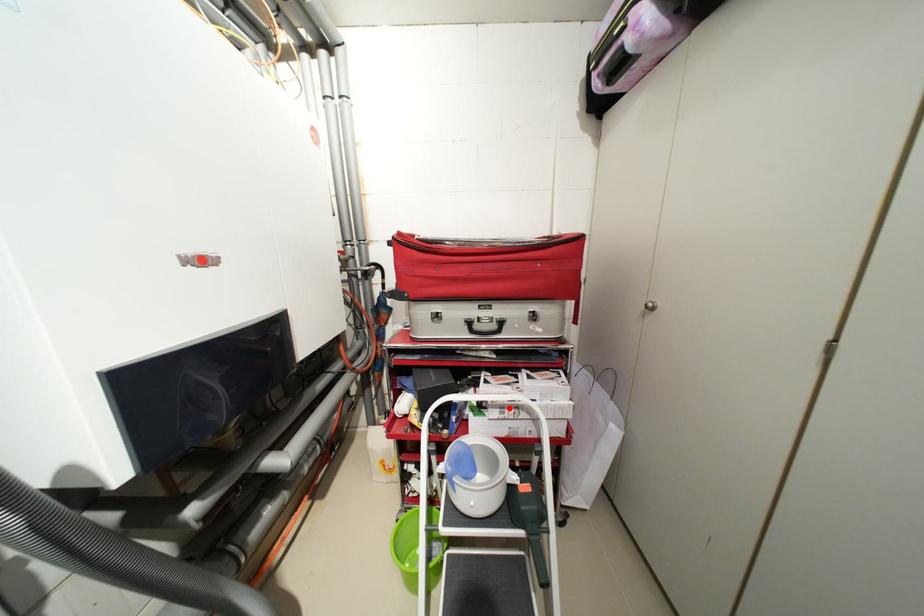
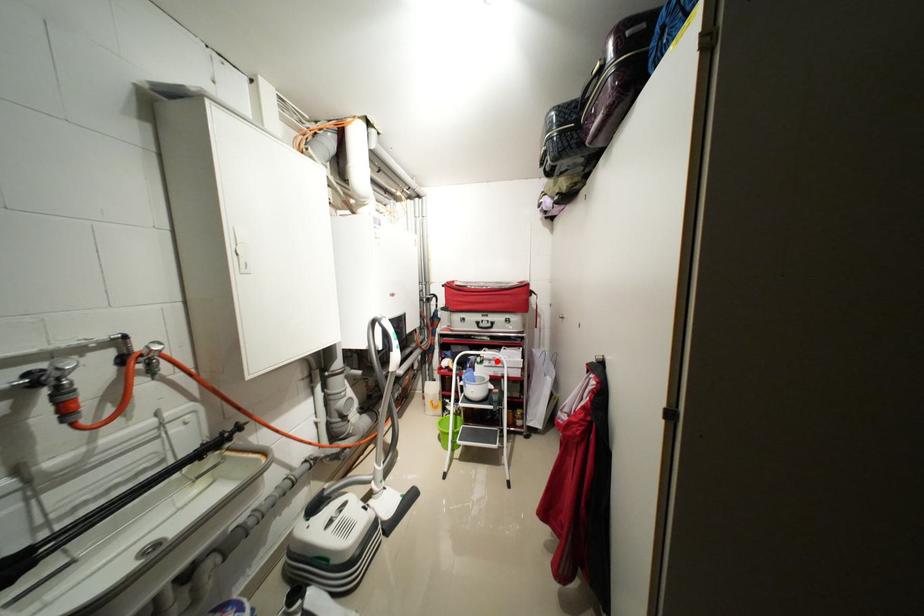
I am providing you with two images of the same scene from different viewpoints. A red point is marked on the first image and another point is marked on the second image. Is the red point in image1 aligned with the point shown in image2?

Yes